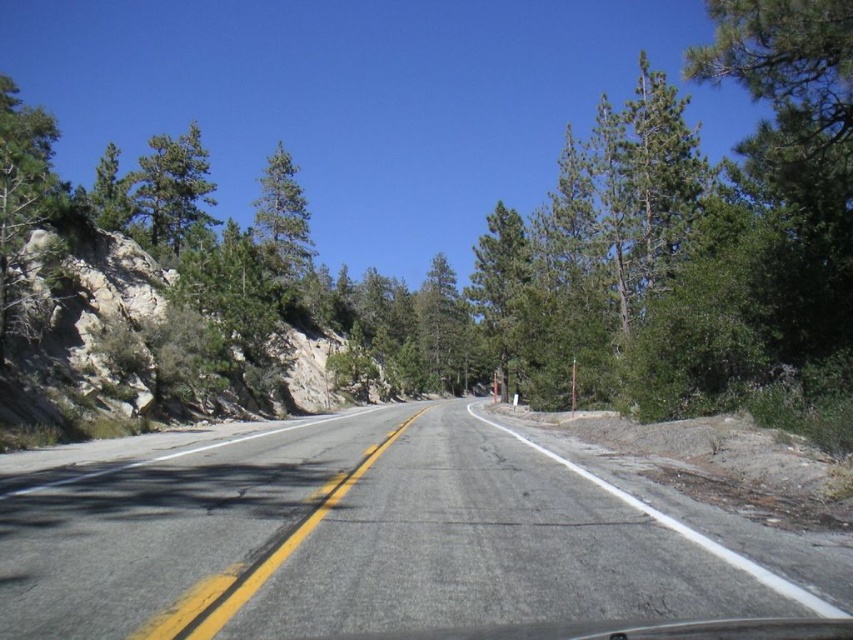
Question: Which object is farther from the camera taking this photo?

Choices:
 (A) green matte tree at upper left
 (B) asphalt road at center
 (C) green matte tree at upper center

Answer: (C)

Question: Does asphalt road at center appear on the right side of green matte tree at upper left?

Choices:
 (A) no
 (B) yes

Answer: (B)

Question: Is the position of green matte tree at upper left less distant than that of green matte tree at upper center?

Choices:
 (A) yes
 (B) no

Answer: (A)

Question: Estimate the real-world distances between objects in this image. Which object is farther from the asphalt road at center?

Choices:
 (A) green matte tree at upper center
 (B) green matte tree at upper left

Answer: (A)

Question: Which of the following is the closest to the observer?

Choices:
 (A) (181, 147)
 (B) (148, 460)

Answer: (B)

Question: Is green matte tree at upper left below green matte tree at upper center?

Choices:
 (A) yes
 (B) no

Answer: (B)